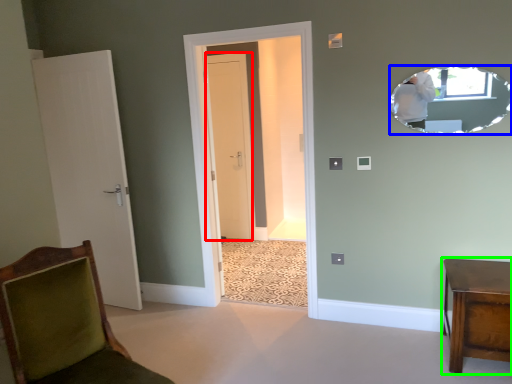
Question: Estimate the real-world distances between objects in this image. Which object is farther from door (highlighted by a red box), mirror (highlighted by a blue box) or furniture (highlighted by a green box)?

Choices:
 (A) mirror
 (B) furniture

Answer: (B)